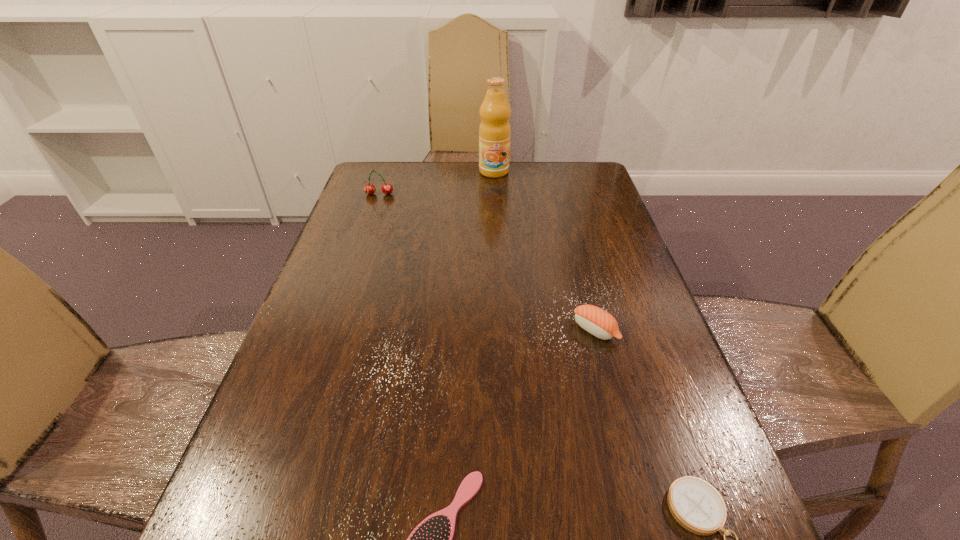
You are a GUI agent. You are given a task and a screenshot of the screen. Output one action in this format:
    pyautogui.click(x=<x>, y=<y>)
    Task: Click on the cherry located at the far edge
    This screenshot has width=960, height=540.
    Given the screenshot: What is the action you would take?
    pyautogui.click(x=387, y=188)

You are a GUI agent. You are given a task and a screenshot of the screen. Output one action in this format:
    pyautogui.click(x=<x>, y=<y>)
    Task: Click on the object that is at the left edge
    This screenshot has height=540, width=960.
    Given the screenshot: What is the action you would take?
    pyautogui.click(x=387, y=188)

The height and width of the screenshot is (540, 960). Find the location of `object at the right edge`. object at the right edge is located at coordinates (598, 322).

The image size is (960, 540). Find the location of `object that is at the far left corner`. object that is at the far left corner is located at coordinates (387, 188).

In the image, there is a desktop. Identify the location of free space at the far edge. This screenshot has width=960, height=540. (538, 177).

The width and height of the screenshot is (960, 540). I want to click on free location at the left edge of the desktop, so 351,203.

Image resolution: width=960 pixels, height=540 pixels. What are the coordinates of `vacant space at the right edge of the desktop` in the screenshot? It's located at (605, 265).

Locate an element on the screen. vacant region at the far left corner of the desktop is located at coordinates (400, 161).

Find the location of a particular element. This screenshot has height=540, width=960. vacant area at the far right corner is located at coordinates (564, 180).

Locate an element on the screen. free space between the farthest object and the sushi is located at coordinates (544, 251).